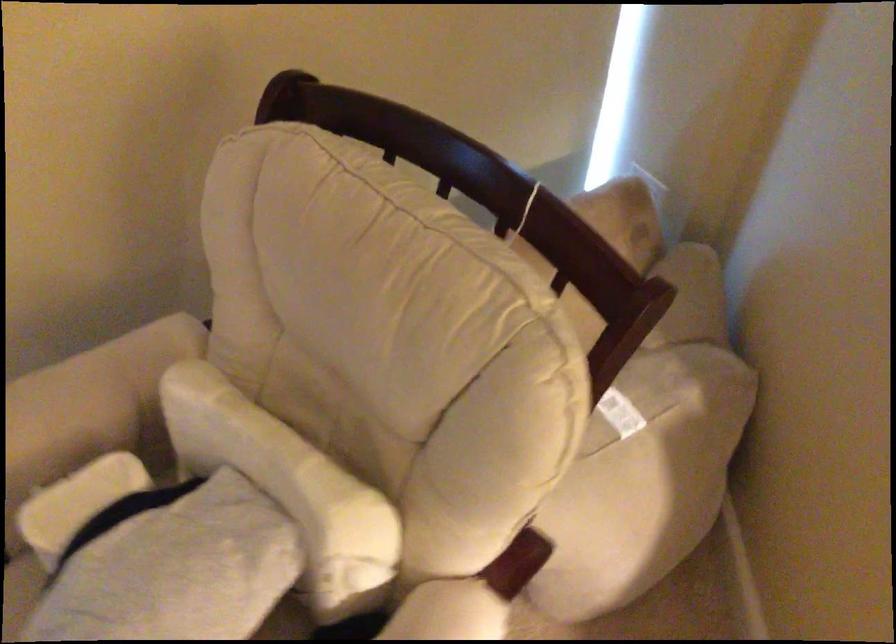
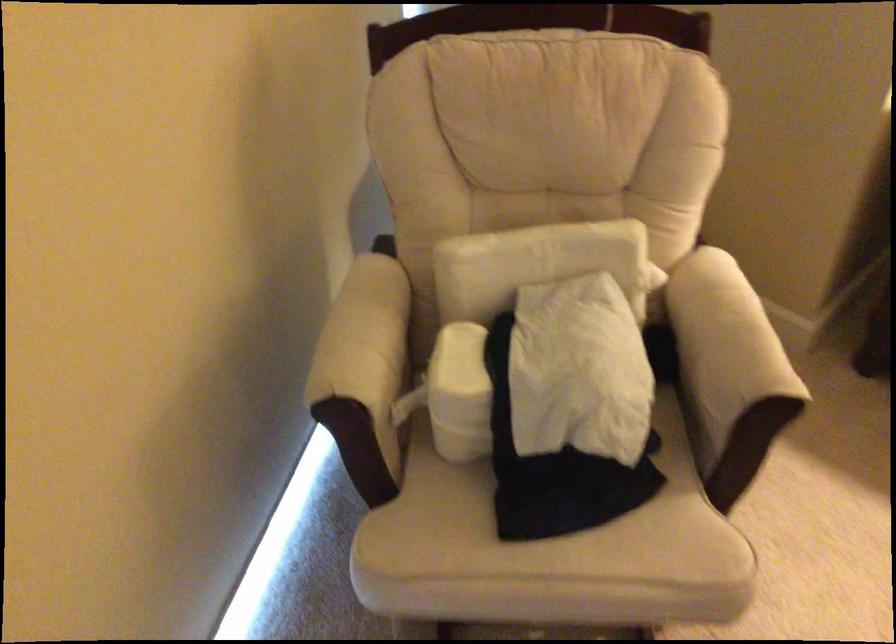
In the second image, find the point that corresponds to (255,448) in the first image.

(533, 263)